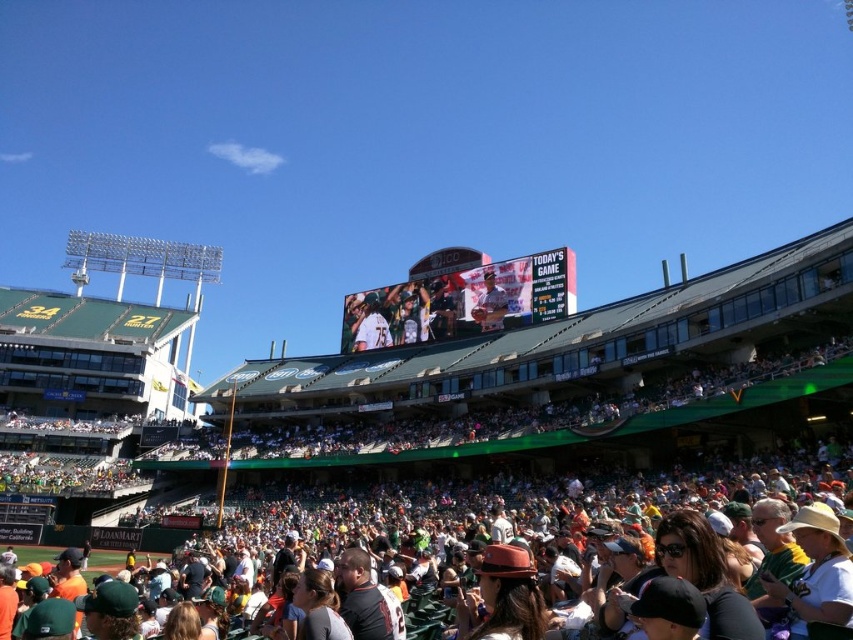
You are a photographer standing at the edge of the crowd, and you want to take a photo of both the white digital scoreboard at center and the matte gray baseball cap at center. The minimum distance you need to be from both objects to capture them clearly is 20 feet. Can you take the photo from your current position?

The white digital scoreboard at center is 19.17 feet from the matte gray baseball cap at center. Since the required minimum distance to capture both clearly is 20 feet, you are too close. Move back a few steps to ensure both objects are within the camera frame.

You are a drone operator who needs to fly a drone from your current position to the white digital scoreboard at center. The drone has a maximum flight range of 90 meters. Can the drone reach the scoreboard?

The white digital scoreboard at center is 89.86 meters away from the viewer. Since the drone has a maximum flight range of 90 meters, it can just barely reach the scoreboard.